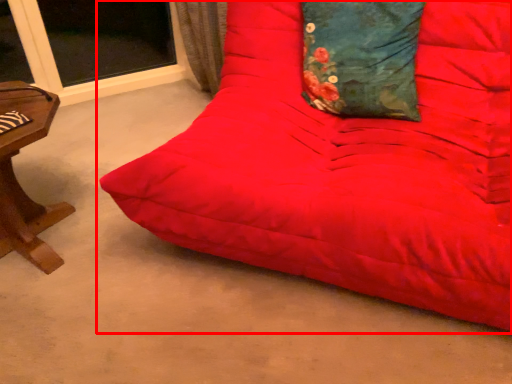
Question: Considering the relative positions of studio couch (annotated by the red box) and pillow in the image provided, where is studio couch (annotated by the red box) located with respect to the staircase?

Choices:
 (A) left
 (B) right

Answer: (A)